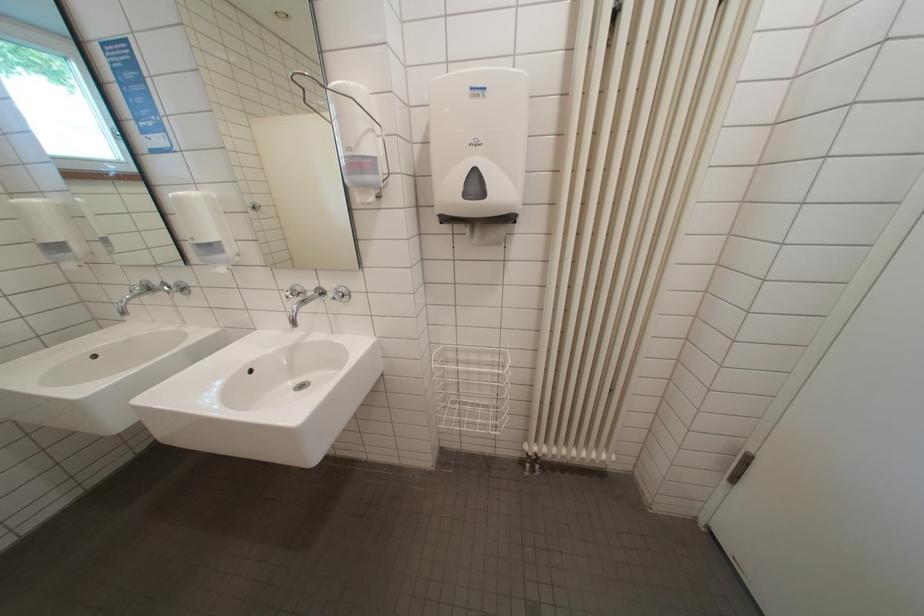
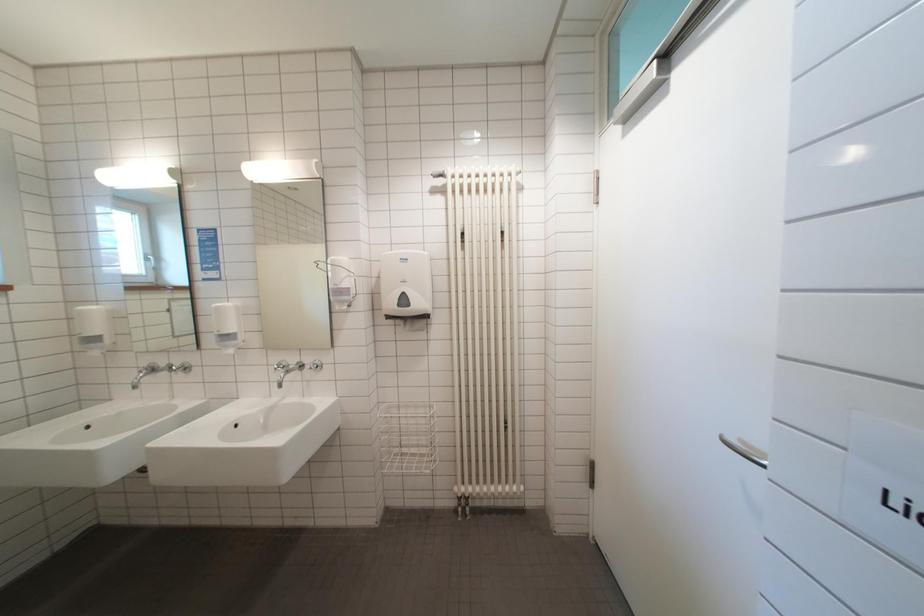
Question: The images are taken continuously from a first-person perspective. In which direction is your viewpoint rotating?

Choices:
 (A) Left
 (B) Right
 (C) Up
 (D) Down

Answer: (C)